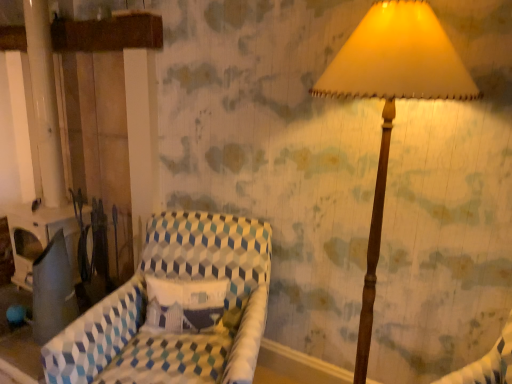
Question: Is patterned fabric chair at center placed right next to wooden lampshade at upper right?

Choices:
 (A) no
 (B) yes

Answer: (A)

Question: Is patterned fabric chair at center thinner than wooden lampshade at upper right?

Choices:
 (A) yes
 (B) no

Answer: (B)

Question: Can you confirm if patterned fabric chair at center is shorter than wooden lampshade at upper right?

Choices:
 (A) no
 (B) yes

Answer: (B)

Question: Is patterned fabric chair at center at the right side of wooden lampshade at upper right?

Choices:
 (A) yes
 (B) no

Answer: (B)

Question: Is patterned fabric chair at center to the left of wooden lampshade at upper right from the viewer's perspective?

Choices:
 (A) yes
 (B) no

Answer: (A)

Question: Is there a large distance between patterned fabric chair at center and wooden lampshade at upper right?

Choices:
 (A) yes
 (B) no

Answer: (B)

Question: Is wooden lampshade at upper right outside of patterned fabric chair at center?

Choices:
 (A) yes
 (B) no

Answer: (A)

Question: Is wooden lampshade at upper right taller than patterned fabric chair at center?

Choices:
 (A) yes
 (B) no

Answer: (A)

Question: Is wooden lampshade at upper right touching patterned fabric chair at center?

Choices:
 (A) no
 (B) yes

Answer: (A)

Question: Is the position of wooden lampshade at upper right less distant than that of patterned fabric chair at center?

Choices:
 (A) yes
 (B) no

Answer: (A)

Question: Does wooden lampshade at upper right have a lesser height compared to patterned fabric chair at center?

Choices:
 (A) no
 (B) yes

Answer: (A)

Question: Does wooden lampshade at upper right have a larger size compared to patterned fabric chair at center?

Choices:
 (A) no
 (B) yes

Answer: (A)

Question: From a real-world perspective, is patterned fabric chair at center positioned above or below wooden lampshade at upper right?

Choices:
 (A) below
 (B) above

Answer: (A)